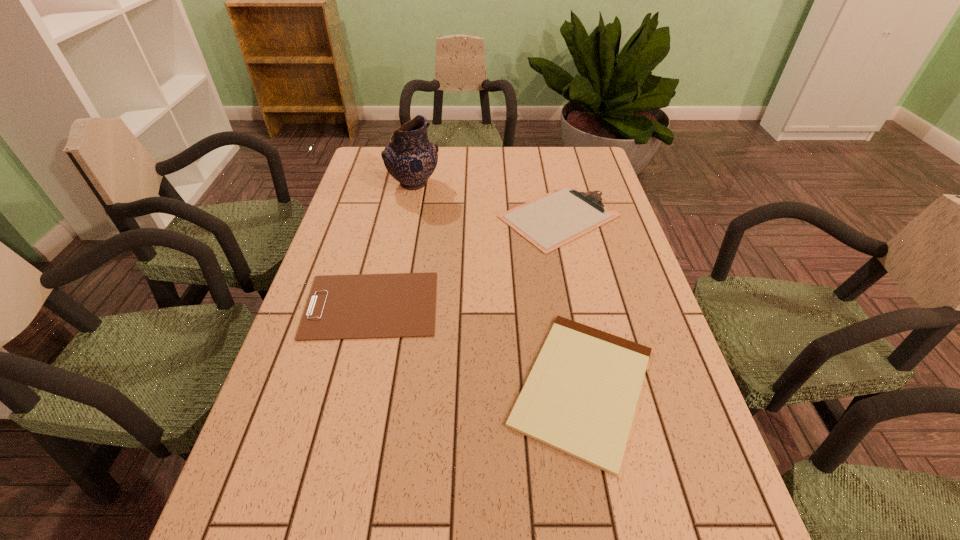
At what (x,y) coordinates should I click in order to perform the action: click on pottery. Please return your answer as a coordinate pair (x, y). This screenshot has height=540, width=960. Looking at the image, I should click on (410, 157).

You are a GUI agent. You are given a task and a screenshot of the screen. Output one action in this format:
    pyautogui.click(x=<x>, y=<y>)
    Task: Click on the third shortest object
    This screenshot has height=540, width=960.
    Given the screenshot: What is the action you would take?
    pyautogui.click(x=550, y=221)

Locate an element on the screen. the tallest clipboard is located at coordinates (550, 221).

This screenshot has width=960, height=540. I want to click on the leftmost clipboard, so click(366, 306).

Find the location of a particular element. The height and width of the screenshot is (540, 960). the second tallest clipboard is located at coordinates (366, 306).

This screenshot has height=540, width=960. I want to click on the shortest clipboard, so click(x=580, y=397).

Image resolution: width=960 pixels, height=540 pixels. I want to click on free region located on the front of the tallest object, so pyautogui.click(x=395, y=284).

This screenshot has height=540, width=960. In order to click on vacant space positioned on the front of the second tallest object in this screenshot , I will do `click(575, 288)`.

Locate an element on the screen. The image size is (960, 540). free space located 0.330m on the back of the second tallest clipboard is located at coordinates (396, 202).

Identify the location of blank space located on the back of the shortest clipboard. (564, 285).